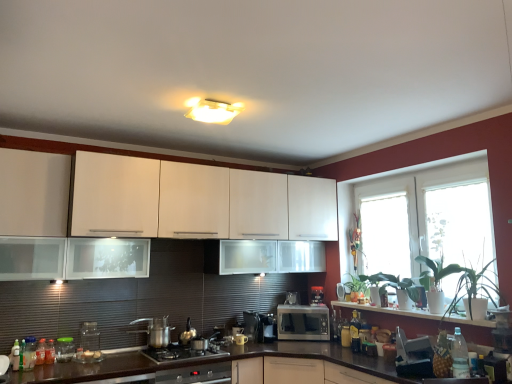
Question: Is clear glass jar at lower left, acting as the fifth appliance starting from the right, further to camera compared to transparent glass window at right, the first window screen from the front?

Choices:
 (A) yes
 (B) no

Answer: (A)

Question: Would you say clear glass jar at lower left, the 4th appliance positioned from the back, is outside transparent glass window at right, which is the second window screen in back-to-front order?

Choices:
 (A) yes
 (B) no

Answer: (A)

Question: Is clear glass jar at lower left, which is the third appliance in front-to-back order, at the right side of transparent glass window at right, the first window screen from the front?

Choices:
 (A) no
 (B) yes

Answer: (A)

Question: Does clear glass jar at lower left, which is counted as the second appliance, starting from the left, have a larger size compared to transparent glass window at right, which appears as the second window screen when viewed from the left?

Choices:
 (A) yes
 (B) no

Answer: (B)

Question: From the image's perspective, is clear glass jar at lower left, which is counted as the second appliance, starting from the left, located above transparent glass window at right, which ranks as the first window screen in right-to-left order?

Choices:
 (A) yes
 (B) no

Answer: (B)

Question: Is clear glass jar at lower left, acting as the fifth appliance starting from the right, far from transparent glass window at right, which is the second window screen in back-to-front order?

Choices:
 (A) yes
 (B) no

Answer: (A)

Question: From the image's perspective, does translucent plastic bottle at lower right, marked as the 3th bottle in a front-to-back arrangement, appear higher than metallic silver kettle at center, which is the 3th appliance in left-to-right order?

Choices:
 (A) yes
 (B) no

Answer: (B)

Question: Considering the relative sizes of translucent plastic bottle at lower right, marked as the 2th bottle in a right-to-left arrangement, and metallic silver kettle at center, marked as the fourth appliance in a right-to-left arrangement, in the image provided, is translucent plastic bottle at lower right, marked as the 2th bottle in a right-to-left arrangement, taller than metallic silver kettle at center, marked as the fourth appliance in a right-to-left arrangement,?

Choices:
 (A) no
 (B) yes

Answer: (B)

Question: Is translucent plastic bottle at lower right, which appears as the 1th bottle when viewed from the back, behind metallic silver kettle at center, which is the 3th appliance in left-to-right order?

Choices:
 (A) no
 (B) yes

Answer: (B)

Question: Is translucent plastic bottle at lower right, marked as the 3th bottle in a front-to-back arrangement, smaller than metallic silver kettle at center, which ranks as the 3th appliance in back-to-front order?

Choices:
 (A) yes
 (B) no

Answer: (A)

Question: From a real-world perspective, is translucent plastic bottle at lower right, which appears as the 1th bottle when viewed from the back, located beneath metallic silver kettle at center, which is the 3th appliance in left-to-right order?

Choices:
 (A) no
 (B) yes

Answer: (B)

Question: From a real-world perspective, is translucent plastic bottle at lower right, marked as the 3th bottle in a front-to-back arrangement, physically above metallic silver kettle at center, which ranks as the fourth appliance in front-to-back order?

Choices:
 (A) no
 (B) yes

Answer: (A)

Question: Is golden glass bottle at center-right, the 2th bottle in the back-to-front sequence, next to white glossy window at lower right?

Choices:
 (A) yes
 (B) no

Answer: (B)